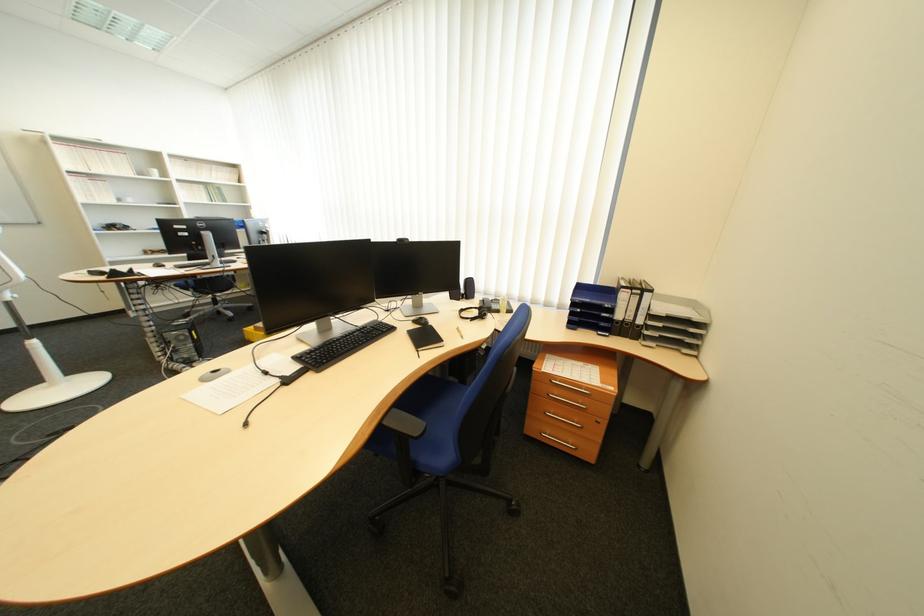
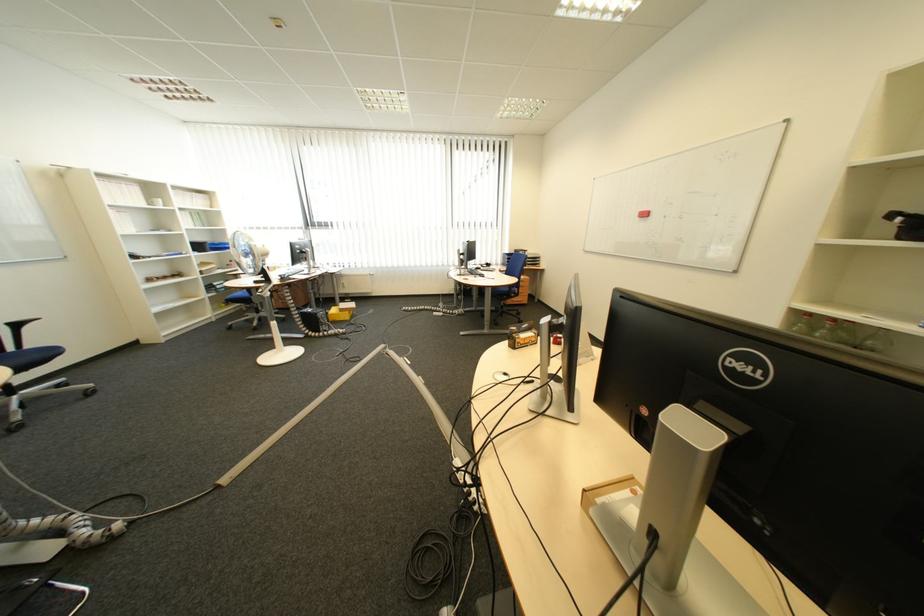
In the second image, find the point that corresponds to point 195,339 in the first image.

(335, 317)